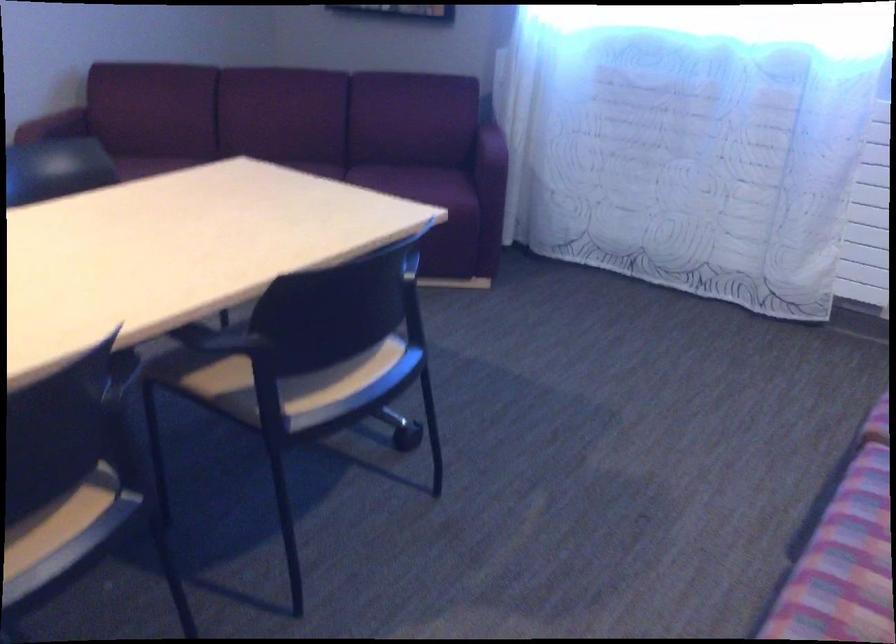
Describe the element at coordinates (54, 125) in the screenshot. I see `the sofa armrest` at that location.